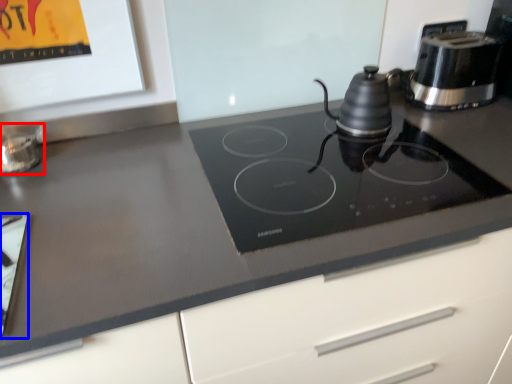
Question: Which object appears closest to the camera in this image, appliance (highlighted by a red box) or appliance (highlighted by a blue box)?

Choices:
 (A) appliance
 (B) appliance

Answer: (B)